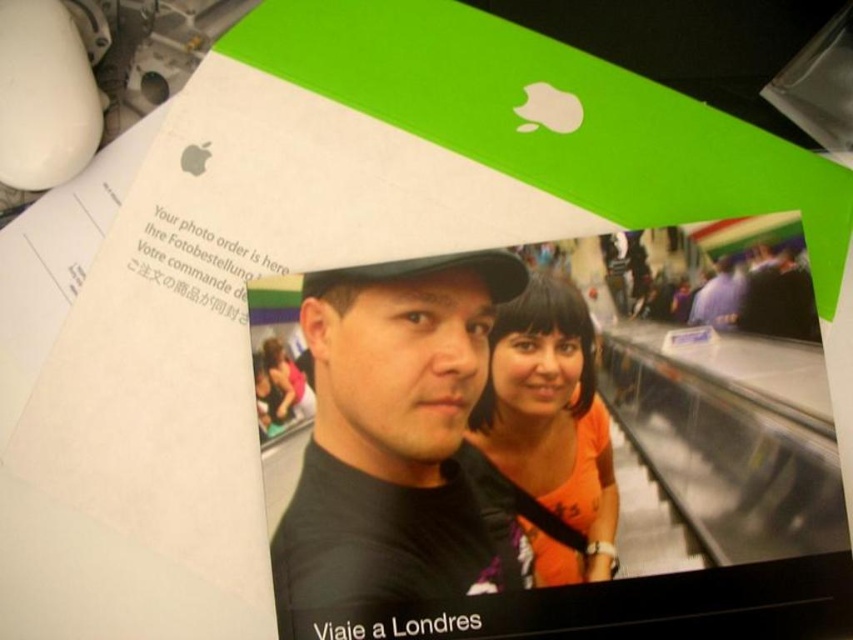
Question: Can you confirm if black matte shirt at center is positioned below orange matte shirt at center?

Choices:
 (A) yes
 (B) no

Answer: (A)

Question: Can you confirm if black matte shirt at center is positioned to the right of orange matte shirt at center?

Choices:
 (A) no
 (B) yes

Answer: (A)

Question: Which object appears farthest from the camera in this image?

Choices:
 (A) orange matte shirt at center
 (B) black matte shirt at center

Answer: (B)

Question: Which object appears farthest from the camera in this image?

Choices:
 (A) black matte shirt at center
 (B) orange matte shirt at center

Answer: (A)

Question: Is black matte shirt at center below orange matte shirt at center?

Choices:
 (A) yes
 (B) no

Answer: (A)